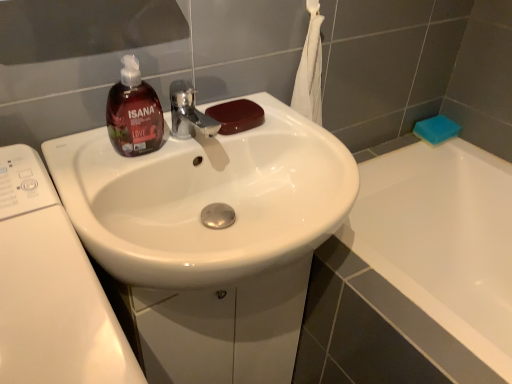
Question: Which direction should I rotate to look at brown glossy soap at sink, arranged as the 2th soap when viewed from the right?

Choices:
 (A) left
 (B) right

Answer: (A)

Question: Could you tell me if brown matte liquid soap at upper left is turned towards white glossy sink at center?

Choices:
 (A) yes
 (B) no

Answer: (B)

Question: Is brown matte liquid soap at upper left in contact with white glossy sink at center?

Choices:
 (A) yes
 (B) no

Answer: (B)

Question: Does brown matte liquid soap at upper left have a larger size compared to white glossy sink at center?

Choices:
 (A) no
 (B) yes

Answer: (A)

Question: Would you consider brown matte liquid soap at upper left to be distant from white glossy sink at center?

Choices:
 (A) yes
 (B) no

Answer: (B)

Question: From the image's perspective, does brown matte liquid soap at upper left appear higher than white glossy sink at center?

Choices:
 (A) yes
 (B) no

Answer: (A)

Question: Does brown matte liquid soap at upper left have a greater width compared to white glossy sink at center?

Choices:
 (A) no
 (B) yes

Answer: (A)

Question: Can we say brown matte liquid soap at upper left lies outside brown glossy soap at sink, arranged as the 2th soap when viewed from the right?

Choices:
 (A) no
 (B) yes

Answer: (B)

Question: Considering the relative sizes of brown matte liquid soap at upper left and brown glossy soap at sink, which is the 1th soap in front-to-back order, in the image provided, is brown matte liquid soap at upper left shorter than brown glossy soap at sink, which is the 1th soap in front-to-back order,?

Choices:
 (A) no
 (B) yes

Answer: (A)

Question: Is the depth of brown matte liquid soap at upper left less than that of brown glossy soap at sink, marked as the second soap in a back-to-front arrangement?

Choices:
 (A) yes
 (B) no

Answer: (A)

Question: Is brown matte liquid soap at upper left positioned behind brown glossy soap at sink, which is the 1th soap in front-to-back order?

Choices:
 (A) no
 (B) yes

Answer: (A)

Question: From a real-world perspective, is brown matte liquid soap at upper left located higher than brown glossy soap at sink, arranged as the 2th soap when viewed from the right?

Choices:
 (A) yes
 (B) no

Answer: (A)

Question: Is brown matte liquid soap at upper left with brown glossy soap at sink, arranged as the 2th soap when viewed from the right?

Choices:
 (A) yes
 (B) no

Answer: (B)

Question: Considering the relative positions of blue sponge at upper right, the 1th soap from the right, and white glossy sink at center in the image provided, is blue sponge at upper right, the 1th soap from the right, to the right of white glossy sink at center from the viewer's perspective?

Choices:
 (A) yes
 (B) no

Answer: (A)